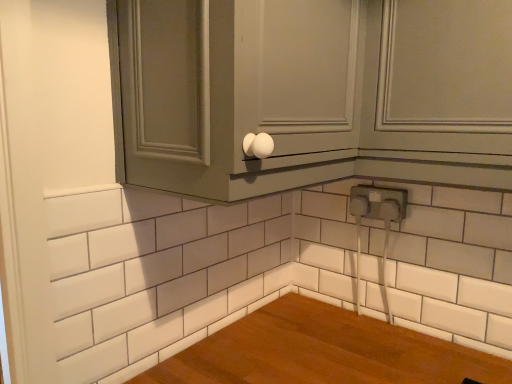
Describe the element at coordinates (314, 93) in the screenshot. I see `matte gray cabinet at upper center` at that location.

The width and height of the screenshot is (512, 384). Identify the location of matte gray cabinet at upper right. (438, 76).

The height and width of the screenshot is (384, 512). In order to click on window to the right of white plastic electrical outlet at lower right in this screenshot , I will do `click(438, 76)`.

Which object is wider, white plastic electrical outlet at lower right or matte gray cabinet at upper right?

matte gray cabinet at upper right.

Consider the image. From a real-world perspective, does white plastic electrical outlet at lower right sit lower than matte gray cabinet at upper right?

Yes, from a real-world perspective, white plastic electrical outlet at lower right is beneath matte gray cabinet at upper right.

Considering the sizes of white plastic electrical outlet at lower right and matte gray cabinet at upper right in the image, is white plastic electrical outlet at lower right taller or shorter than matte gray cabinet at upper right?

white plastic electrical outlet at lower right is shorter than matte gray cabinet at upper right.

Which of these two, matte gray cabinet at upper right or matte gray cabinet at upper center, is wider?

matte gray cabinet at upper center is wider.

From a real-world perspective, is matte gray cabinet at upper right positioned above or below matte gray cabinet at upper center?

From a real-world perspective, matte gray cabinet at upper right is physically below matte gray cabinet at upper center.

Which object is positioned more to the right, matte gray cabinet at upper center or white plastic electrical outlet at lower right?

white plastic electrical outlet at lower right is more to the right.

From the image's perspective, is matte gray cabinet at upper center located above or below white plastic electrical outlet at lower right?

From the image's perspective, matte gray cabinet at upper center appears above white plastic electrical outlet at lower right.

Considering the sizes of objects matte gray cabinet at upper center and white plastic electrical outlet at lower right in the image provided, who is wider, matte gray cabinet at upper center or white plastic electrical outlet at lower right?

Wider between the two is matte gray cabinet at upper center.

Is white plastic electrical outlet at lower right a part of matte gray cabinet at upper center?

No.

Is matte gray cabinet at upper right completely or partially outside of white plastic electrical outlet at lower right?

That's correct, matte gray cabinet at upper right is outside of white plastic electrical outlet at lower right.

Which of these two, matte gray cabinet at upper right or white plastic electrical outlet at lower right, is thinner?

white plastic electrical outlet at lower right is thinner.

Is the depth of matte gray cabinet at upper right greater than that of white plastic electrical outlet at lower right?

No, matte gray cabinet at upper right is closer to the camera.

Is matte gray cabinet at upper right turned away from white plastic electrical outlet at lower right?

No, matte gray cabinet at upper right's orientation is not away from white plastic electrical outlet at lower right.

Considering their positions, is white plastic electrical outlet at lower right located in front of or behind matte gray cabinet at upper center?

white plastic electrical outlet at lower right is positioned farther from the viewer than matte gray cabinet at upper center.

Would you say white plastic electrical outlet at lower right is a long distance from matte gray cabinet at upper center?

No, white plastic electrical outlet at lower right is in close proximity to matte gray cabinet at upper center.

Considering the sizes of white plastic electrical outlet at lower right and matte gray cabinet at upper center in the image, is white plastic electrical outlet at lower right wider or thinner than matte gray cabinet at upper center?

white plastic electrical outlet at lower right is thinner than matte gray cabinet at upper center.

Is point (389, 219) closer or farther from the camera than point (258, 85)?

Point (389, 219).

Between point (177, 44) and point (490, 40), which one is positioned behind?

Point (490, 40)

Considering the relative sizes of matte gray cabinet at upper center and matte gray cabinet at upper right in the image provided, is matte gray cabinet at upper center wider than matte gray cabinet at upper right?

Yes, matte gray cabinet at upper center is wider than matte gray cabinet at upper right.

From the image's perspective, is matte gray cabinet at upper center over matte gray cabinet at upper right?

Correct, matte gray cabinet at upper center appears higher than matte gray cabinet at upper right in the image.

Find the location of a particular element. This screenshot has height=384, width=512. window below the matte gray cabinet at upper center (from the image's perspective) is located at coordinates (438, 76).

Image resolution: width=512 pixels, height=384 pixels. In the image, there is a matte gray cabinet at upper right. What are the coordinates of `electric outlet below it (from a real-world perspective)` in the screenshot? It's located at (378, 202).

Where is `cabinetry located on the left of matte gray cabinet at upper right`? cabinetry located on the left of matte gray cabinet at upper right is located at coordinates 314,93.

Looking at the image, which one is located further to white plastic electrical outlet at lower right, matte gray cabinet at upper center or matte gray cabinet at upper right?

matte gray cabinet at upper center.

Considering their positions, is matte gray cabinet at upper right positioned closer to white plastic electrical outlet at lower right than matte gray cabinet at upper center?

matte gray cabinet at upper right lies closer to white plastic electrical outlet at lower right than the other object.

When comparing their distances from matte gray cabinet at upper center, does matte gray cabinet at upper right or white plastic electrical outlet at lower right seem further?

The object further to matte gray cabinet at upper center is white plastic electrical outlet at lower right.

Considering their positions, is white plastic electrical outlet at lower right positioned closer to matte gray cabinet at upper right than matte gray cabinet at upper center?

Based on the image, matte gray cabinet at upper center appears to be nearer to matte gray cabinet at upper right.

From the image, which object appears to be nearer to matte gray cabinet at upper center, white plastic electrical outlet at lower right or matte gray cabinet at upper right?

matte gray cabinet at upper right lies closer to matte gray cabinet at upper center than the other object.

From the image, which object appears to be farther from matte gray cabinet at upper right, matte gray cabinet at upper center or white plastic electrical outlet at lower right?

white plastic electrical outlet at lower right.

The height and width of the screenshot is (384, 512). Identify the location of window between matte gray cabinet at upper center and white plastic electrical outlet at lower right in the front-back direction. (438, 76).